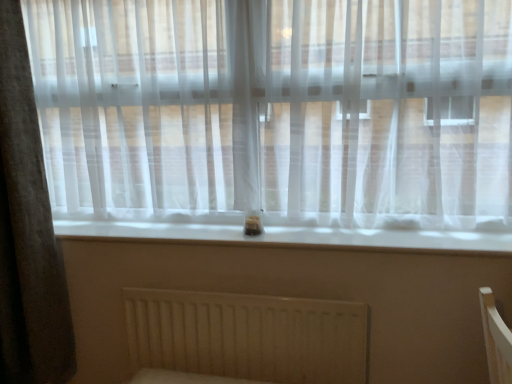
What are the coordinates of `free space above white smooth window sill at center (from a real-world perspective)` in the screenshot? It's located at (295, 227).